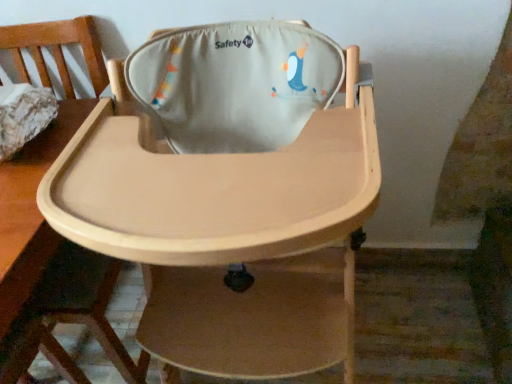
This screenshot has height=384, width=512. Describe the element at coordinates (49, 227) in the screenshot. I see `matte beige highchair at center, acting as the first chair starting from the left` at that location.

This screenshot has height=384, width=512. In order to click on matte beige highchair at center, the second chair when ordered from right to left in this screenshot , I will do `click(49, 227)`.

Image resolution: width=512 pixels, height=384 pixels. What do you see at coordinates (228, 234) in the screenshot? I see `natural wood highchair at center, which is the 2th chair from left to right` at bounding box center [228, 234].

At what (x,y) coordinates should I click in order to perform the action: click on natural wood highchair at center, which is counted as the first chair, starting from the right. Please return your answer as a coordinate pair (x, y). Image resolution: width=512 pixels, height=384 pixels. Looking at the image, I should click on (228, 234).

Where is `matte beige highchair at center, acting as the first chair starting from the left`? matte beige highchair at center, acting as the first chair starting from the left is located at coordinates (49, 227).

Considering the relative positions of natural wood highchair at center, which is the 2th chair from left to right, and matte beige highchair at center, the second chair when ordered from right to left, in the image provided, is natural wood highchair at center, which is the 2th chair from left to right, to the left of matte beige highchair at center, the second chair when ordered from right to left, from the viewer's perspective?

No.

Which object is closer to the camera taking this photo, natural wood highchair at center, which is counted as the first chair, starting from the right, or matte beige highchair at center, acting as the first chair starting from the left?

natural wood highchair at center, which is counted as the first chair, starting from the right.

Is point (234, 331) behind point (104, 349)?

No, it is in front of (104, 349).

From the image's perspective, which is above, natural wood highchair at center, which is counted as the first chair, starting from the right, or matte beige highchair at center, the second chair when ordered from right to left?

matte beige highchair at center, the second chair when ordered from right to left, from the image's perspective.

From a real-world perspective, who is located lower, natural wood highchair at center, which is the 2th chair from left to right, or matte beige highchair at center, acting as the first chair starting from the left?

matte beige highchair at center, acting as the first chair starting from the left.

Considering the relative sizes of natural wood highchair at center, which is counted as the first chair, starting from the right, and matte beige highchair at center, the second chair when ordered from right to left, in the image provided, is natural wood highchair at center, which is counted as the first chair, starting from the right, wider than matte beige highchair at center, the second chair when ordered from right to left,?

No, natural wood highchair at center, which is counted as the first chair, starting from the right, is not wider than matte beige highchair at center, the second chair when ordered from right to left.

Considering the relative sizes of natural wood highchair at center, which is counted as the first chair, starting from the right, and matte beige highchair at center, the second chair when ordered from right to left, in the image provided, is natural wood highchair at center, which is counted as the first chair, starting from the right, taller than matte beige highchair at center, the second chair when ordered from right to left,?

Result: Yes.

Considering the sizes of objects natural wood highchair at center, which is the 2th chair from left to right, and matte beige highchair at center, the second chair when ordered from right to left, in the image provided, who is bigger, natural wood highchair at center, which is the 2th chair from left to right, or matte beige highchair at center, the second chair when ordered from right to left,?

natural wood highchair at center, which is the 2th chair from left to right.

Is natural wood highchair at center, which is counted as the first chair, starting from the right, spatially inside matte beige highchair at center, acting as the first chair starting from the left, or outside of it?

natural wood highchair at center, which is counted as the first chair, starting from the right, is not inside matte beige highchair at center, acting as the first chair starting from the left, it's outside.

Is natural wood highchair at center, which is counted as the first chair, starting from the right, positioned far away from matte beige highchair at center, the second chair when ordered from right to left?

Actually, natural wood highchair at center, which is counted as the first chair, starting from the right, and matte beige highchair at center, the second chair when ordered from right to left, are a little close together.

Is matte beige highchair at center, acting as the first chair starting from the left, at the back of natural wood highchair at center, which is the 2th chair from left to right?

That's not correct — natural wood highchair at center, which is the 2th chair from left to right, is not looking away from matte beige highchair at center, acting as the first chair starting from the left.

Locate an element on the screen. chair behind the natural wood highchair at center, which is the 2th chair from left to right is located at coordinates (49, 227).

Between matte beige highchair at center, acting as the first chair starting from the left, and natural wood highchair at center, which is counted as the first chair, starting from the right, which one appears on the right side from the viewer's perspective?

Positioned to the right is natural wood highchair at center, which is counted as the first chair, starting from the right.

Between matte beige highchair at center, the second chair when ordered from right to left, and natural wood highchair at center, which is the 2th chair from left to right, which one is positioned behind?

matte beige highchair at center, the second chair when ordered from right to left, is more distant.

Is point (18, 285) positioned behind point (298, 329)?

No, (18, 285) is in front of (298, 329).

In the scene shown: From the image's perspective, between matte beige highchair at center, the second chair when ordered from right to left, and natural wood highchair at center, which is the 2th chair from left to right, who is located below?

natural wood highchair at center, which is the 2th chair from left to right, from the image's perspective.

From a real-world perspective, is matte beige highchair at center, the second chair when ordered from right to left, physically located above or below natural wood highchair at center, which is the 2th chair from left to right?

Clearly, from a real-world perspective, matte beige highchair at center, the second chair when ordered from right to left, is below natural wood highchair at center, which is the 2th chair from left to right.

Considering the sizes of objects matte beige highchair at center, acting as the first chair starting from the left, and natural wood highchair at center, which is the 2th chair from left to right, in the image provided, who is wider, matte beige highchair at center, acting as the first chair starting from the left, or natural wood highchair at center, which is the 2th chair from left to right,?

matte beige highchair at center, acting as the first chair starting from the left, is wider.

From the picture: Considering the sizes of matte beige highchair at center, the second chair when ordered from right to left, and natural wood highchair at center, which is the 2th chair from left to right, in the image, is matte beige highchair at center, the second chair when ordered from right to left, taller or shorter than natural wood highchair at center, which is the 2th chair from left to right,?

In the image, matte beige highchair at center, the second chair when ordered from right to left, appears to be shorter than natural wood highchair at center, which is the 2th chair from left to right.

Which of these two, matte beige highchair at center, acting as the first chair starting from the left, or natural wood highchair at center, which is the 2th chair from left to right, is bigger?

natural wood highchair at center, which is the 2th chair from left to right.

Looking at this image, does matte beige highchair at center, the second chair when ordered from right to left, contain natural wood highchair at center, which is the 2th chair from left to right?

No.

Is matte beige highchair at center, the second chair when ordered from right to left, next to natural wood highchair at center, which is counted as the first chair, starting from the right?

No, matte beige highchair at center, the second chair when ordered from right to left, is not with natural wood highchair at center, which is counted as the first chair, starting from the right.

Could you tell me if matte beige highchair at center, the second chair when ordered from right to left, is turned towards natural wood highchair at center, which is counted as the first chair, starting from the right?

No, matte beige highchair at center, the second chair when ordered from right to left, is not aimed at natural wood highchair at center, which is counted as the first chair, starting from the right.

How different are the orientations of matte beige highchair at center, acting as the first chair starting from the left, and natural wood highchair at center, which is the 2th chair from left to right, in degrees?

0.793 degrees.

Find the location of a particular element. chair below the natural wood highchair at center, which is the 2th chair from left to right (from a real-world perspective) is located at coordinates (49, 227).

At what (x,y) coordinates should I click in order to perform the action: click on chair below the matte beige highchair at center, acting as the first chair starting from the left (from the image's perspective). Please return your answer as a coordinate pair (x, y). The width and height of the screenshot is (512, 384). Looking at the image, I should click on (228, 234).

Locate an element on the screen. The image size is (512, 384). chair positioned vertically above the matte beige highchair at center, acting as the first chair starting from the left (from a real-world perspective) is located at coordinates (228, 234).